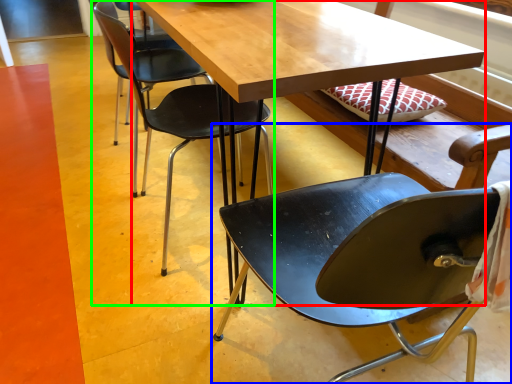
Question: Estimate the real-world distances between objects in this image. Which object is closer to table (highlighted by a red box), chair (highlighted by a blue box) or chair (highlighted by a green box)?

Choices:
 (A) chair
 (B) chair

Answer: (B)